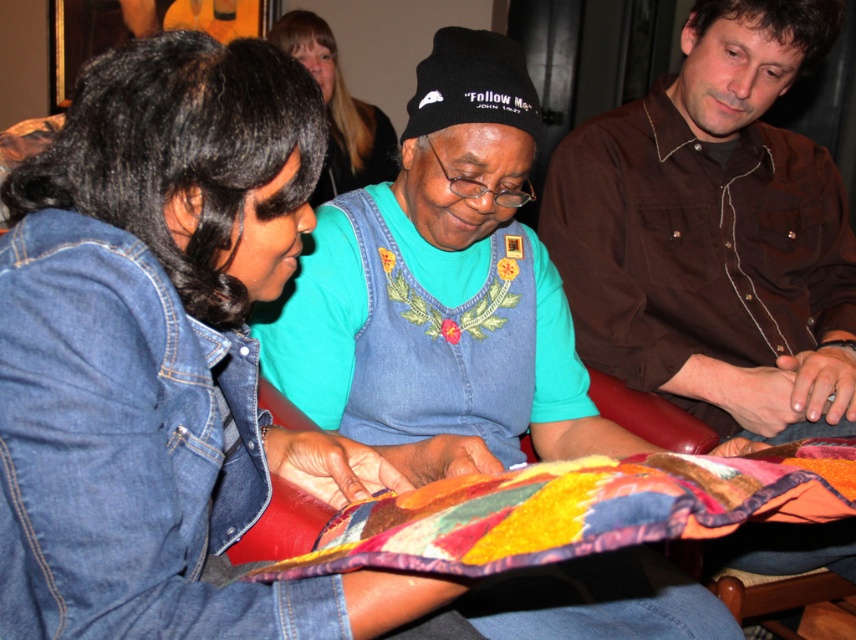
Question: Which of these objects is positioned farthest from the denim jacket at center?

Choices:
 (A) brushed denim jacket at lower left
 (B) multicolored felt cloth at center
 (C) brown textured shirt at center right

Answer: (B)

Question: Which point is farther to the camera?

Choices:
 (A) (690, 252)
 (B) (551, 529)
 (C) (389, 179)

Answer: (C)

Question: Is brushed denim jacket at lower left above multicolored felt cloth at center?

Choices:
 (A) yes
 (B) no

Answer: (A)

Question: Is brown textured shirt at center right above multicolored felt cloth at center?

Choices:
 (A) yes
 (B) no

Answer: (A)

Question: Which of the following is the closest to the observer?

Choices:
 (A) brushed denim jacket at lower left
 (B) brown textured shirt at center right
 (C) multicolored felt cloth at center

Answer: (C)

Question: Is brushed denim jacket at lower left positioned at the back of brown textured shirt at center right?

Choices:
 (A) no
 (B) yes

Answer: (A)